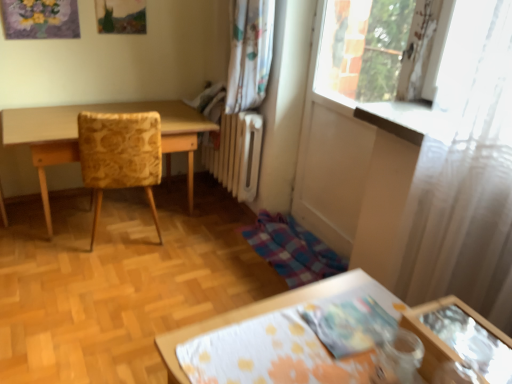
Question: Is yellow floral fabric chair at left taller or shorter than light wood table at left?

Choices:
 (A) tall
 (B) short

Answer: (A)

Question: Is yellow floral fabric chair at left bigger or smaller than light wood table at left?

Choices:
 (A) big
 (B) small

Answer: (B)

Question: Which is nearer to the yellow floral fabric chair at left?

Choices:
 (A) light wood table at left
 (B) white sheer curtain at right

Answer: (A)

Question: Which is nearer to the white sheer curtain at right?

Choices:
 (A) yellow floral fabric chair at left
 (B) light wood table at left

Answer: (A)